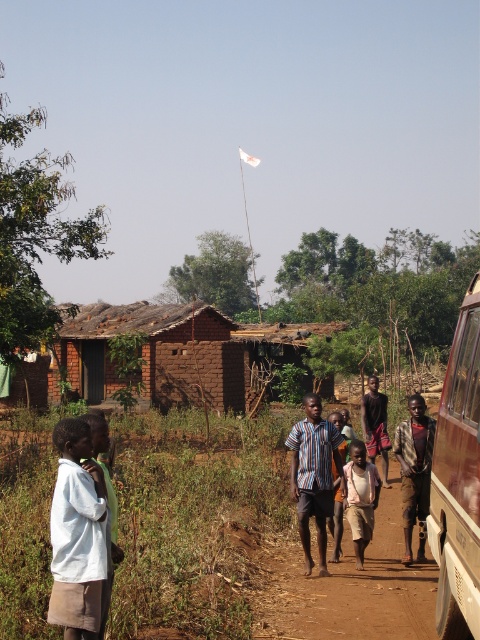
Who is lower down, striped cotton shirt at center or brown woven cloth at center?

brown woven cloth at center is lower down.

Can you confirm if striped cotton shirt at center is shorter than brown woven cloth at center?

Incorrect, striped cotton shirt at center's height does not fall short of brown woven cloth at center's.

The image size is (480, 640). What are the coordinates of `striped cotton shirt at center` in the screenshot? It's located at (313, 476).

What are the coordinates of `striped cotton shirt at center` in the screenshot? It's located at (313, 476).

Which is above, white cotton shirt at lower left or light brown cotton shirt at center?

white cotton shirt at lower left is higher up.

Is white cotton shirt at lower left taller than light brown cotton shirt at center?

No.

Describe the element at coordinates (76, 532) in the screenshot. I see `white cotton shirt at lower left` at that location.

At what (x,y) coordinates should I click in order to perform the action: click on white cotton shirt at lower left. Please return your answer as a coordinate pair (x, y). This screenshot has height=640, width=480. Looking at the image, I should click on (76, 532).

Is white cotton shirt at lower left to the right of striped cotton shirt at center from the viewer's perspective?

Incorrect, white cotton shirt at lower left is not on the right side of striped cotton shirt at center.

From the picture: Can you confirm if white cotton shirt at lower left is taller than striped cotton shirt at center?

No.

Is point (98, 573) closer to camera compared to point (313, 428)?

Yes, it is.

Image resolution: width=480 pixels, height=640 pixels. What are the coordinates of `white cotton shirt at lower left` in the screenshot? It's located at (76, 532).